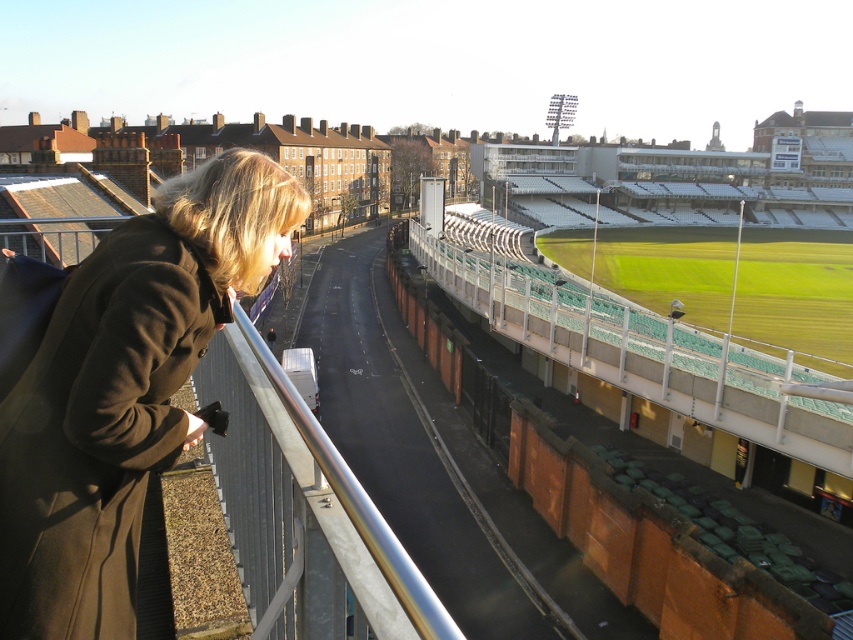
Question: Which of the following is the farthest from the observer?

Choices:
 (A) (345, 525)
 (B) (106, 528)

Answer: (B)

Question: Is matte brown coat at left closer to camera compared to silver metallic railing at center?

Choices:
 (A) yes
 (B) no

Answer: (B)

Question: Does matte brown coat at left appear on the left side of silver metallic railing at center?

Choices:
 (A) no
 (B) yes

Answer: (B)

Question: Is matte brown coat at left positioned behind silver metallic railing at center?

Choices:
 (A) yes
 (B) no

Answer: (A)